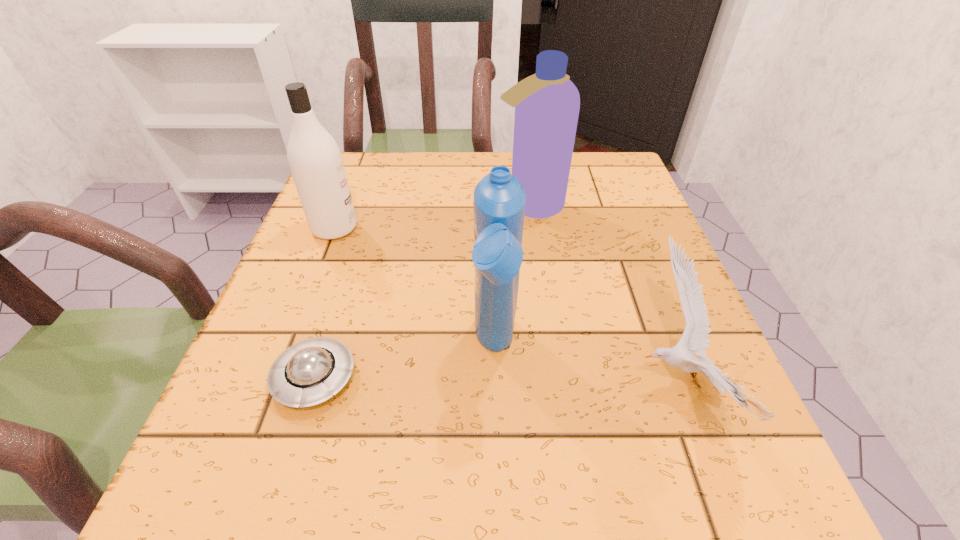
Find the location of a particular element. The height and width of the screenshot is (540, 960). the closest shampoo to the leftmost shampoo is located at coordinates (547, 103).

Find the location of a particular element. free region that satisfies the following two spatial constraints: 1. on the back side of the nearest shampoo; 2. on the front-facing side of the leftmost shampoo is located at coordinates (492, 228).

Find the location of `blank space that satisfies the following two spatial constraints: 1. on the front-facing side of the leftmost shampoo; 2. on the back side of the saucer`. blank space that satisfies the following two spatial constraints: 1. on the front-facing side of the leftmost shampoo; 2. on the back side of the saucer is located at coordinates (277, 378).

Find the location of a particular element. free space that satisfies the following two spatial constraints: 1. on the front-facing side of the leftmost shampoo; 2. on the right side of the nearest shampoo is located at coordinates (288, 348).

Where is `free point that satisfies the following two spatial constraints: 1. on the front-facing side of the leftmost shampoo; 2. on the left side of the saucer`? free point that satisfies the following two spatial constraints: 1. on the front-facing side of the leftmost shampoo; 2. on the left side of the saucer is located at coordinates (277, 378).

Find the location of a particular element. Image resolution: width=960 pixels, height=540 pixels. vacant point that satisfies the following two spatial constraints: 1. on the front-facing side of the leftmost shampoo; 2. on the left side of the nearest shampoo is located at coordinates (288, 348).